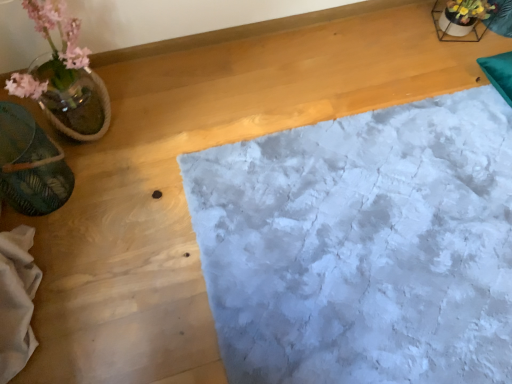
Question: Is the depth of translucent glass vase at left greater than that of white textured rug at center?

Choices:
 (A) no
 (B) yes

Answer: (A)

Question: Is translucent glass vase at left positioned with its back to white textured rug at center?

Choices:
 (A) no
 (B) yes

Answer: (A)

Question: From a real-world perspective, does translucent glass vase at left stand above white textured rug at center?

Choices:
 (A) no
 (B) yes

Answer: (B)

Question: Would you say translucent glass vase at left is a long distance from white textured rug at center?

Choices:
 (A) no
 (B) yes

Answer: (A)

Question: Can you confirm if translucent glass vase at left is wider than white textured rug at center?

Choices:
 (A) no
 (B) yes

Answer: (A)

Question: Could you tell me if translucent glass vase at left is turned towards white textured rug at center?

Choices:
 (A) no
 (B) yes

Answer: (A)

Question: Is green leafy material at left oriented away from translucent glass vase at left?

Choices:
 (A) no
 (B) yes

Answer: (A)

Question: Is green leafy material at left to the right of translucent glass vase at left from the viewer's perspective?

Choices:
 (A) yes
 (B) no

Answer: (B)

Question: Does green leafy material at left have a larger size compared to translucent glass vase at left?

Choices:
 (A) yes
 (B) no

Answer: (B)

Question: From a real-world perspective, does green leafy material at left sit lower than translucent glass vase at left?

Choices:
 (A) no
 (B) yes

Answer: (B)

Question: Could you tell me if green leafy material at left is facing translucent glass vase at left?

Choices:
 (A) no
 (B) yes

Answer: (A)

Question: From the image's perspective, is green leafy material at left located above translucent glass vase at left?

Choices:
 (A) no
 (B) yes

Answer: (A)

Question: Is green leafy material at left wider than white textured rug at center?

Choices:
 (A) no
 (B) yes

Answer: (A)